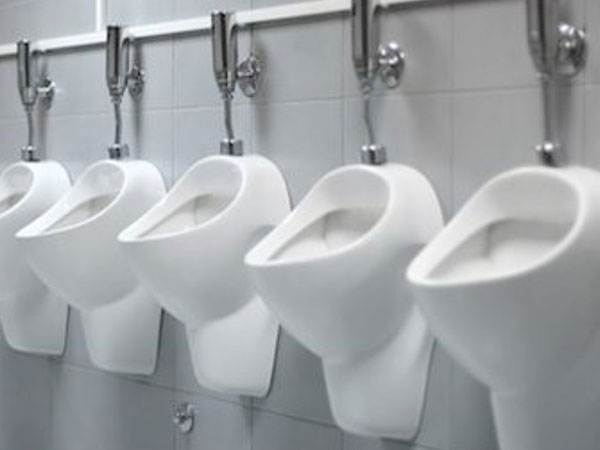
Locate an element on the screen. flush mechanism is located at coordinates (22, 70), (118, 71), (224, 70), (548, 41), (360, 42).